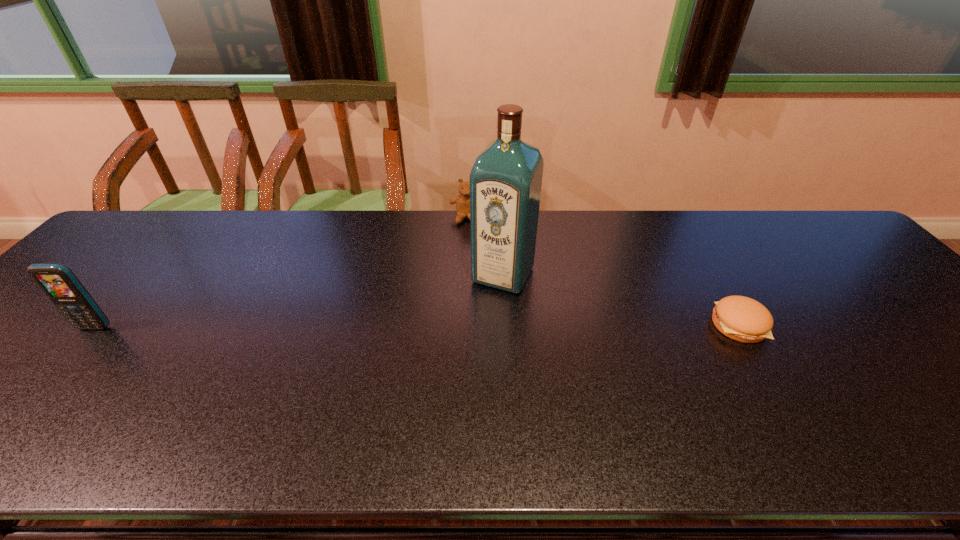
This screenshot has height=540, width=960. In the image, there is a desktop. In order to click on vacant space at the near edge in this screenshot , I will do `click(49, 411)`.

In the image, there is a desktop. Identify the location of free space at the left edge. The height and width of the screenshot is (540, 960). (104, 273).

Where is `vacant space at the far right corner of the desktop`? The height and width of the screenshot is (540, 960). vacant space at the far right corner of the desktop is located at coordinates (786, 224).

Find the location of a particular element. The height and width of the screenshot is (540, 960). blank region between the liquor and the shortest object is located at coordinates (621, 300).

Image resolution: width=960 pixels, height=540 pixels. Find the location of `unoccupied area between the third tallest object and the third shortest object`. unoccupied area between the third tallest object and the third shortest object is located at coordinates pyautogui.click(x=280, y=273).

This screenshot has width=960, height=540. I want to click on empty location between the patty and the leftmost object, so click(x=417, y=326).

In order to click on empty space between the teddy bear and the third shortest object in this screenshot , I will do `click(280, 273)`.

This screenshot has height=540, width=960. Identify the location of blank region between the patty and the farthest object. (603, 272).

Locate an element on the screen. vacant space in between the farthest object and the rightmost object is located at coordinates (603, 272).

Locate an element on the screen. free space that is in between the shortest object and the liquor is located at coordinates pos(621,300).